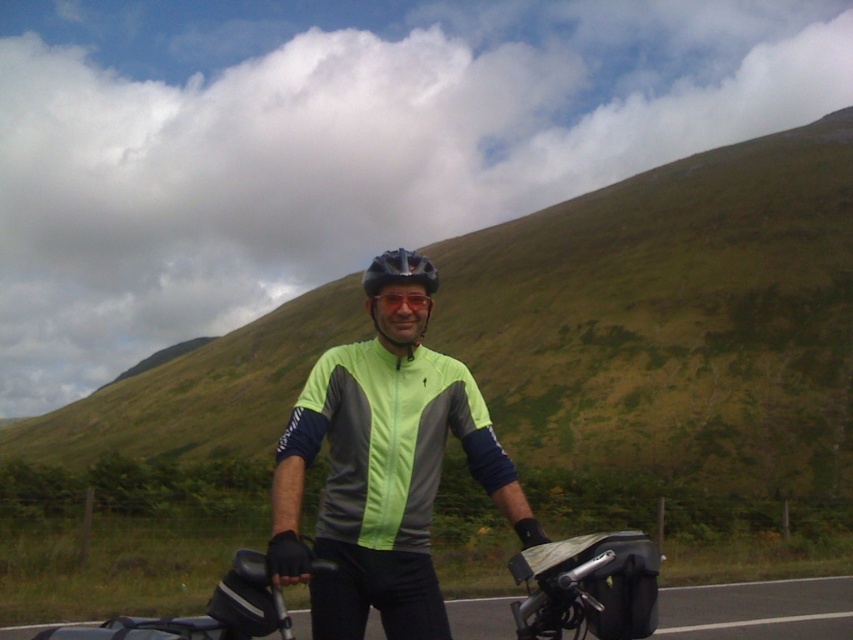
Question: Is black textured bag at center thinner than matte black helmet at center?

Choices:
 (A) yes
 (B) no

Answer: (A)

Question: Which object is farther from the camera taking this photo?

Choices:
 (A) black matte helmet at center
 (B) neon green fabric jacket at center
 (C) black textured bag at center

Answer: (A)

Question: Which object is the closest to the matte black helmet at center?

Choices:
 (A) black matte helmet at center
 (B) black textured bag at center

Answer: (A)

Question: Does neon green fabric jacket at center have a smaller size compared to black matte helmet at center?

Choices:
 (A) yes
 (B) no

Answer: (A)

Question: Which point is closer to the camera taking this photo?

Choices:
 (A) (575, 596)
 (B) (332, 490)
 (C) (428, 291)

Answer: (A)

Question: Considering the relative positions of black textured bag at center and matte black helmet at center in the image provided, where is black textured bag at center located with respect to matte black helmet at center?

Choices:
 (A) below
 (B) above

Answer: (A)